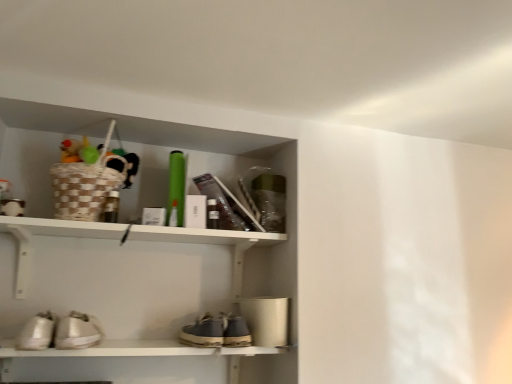
Question: From a real-world perspective, is leather suede shoe at center located higher than white leather sneakers at lower left, positioned as the 2th footwear in right-to-left order?

Choices:
 (A) no
 (B) yes

Answer: (B)

Question: Does leather suede shoe at center have a smaller size compared to white leather sneakers at lower left, arranged as the first footwear when viewed from the left?

Choices:
 (A) yes
 (B) no

Answer: (B)

Question: Is white leather sneakers at lower left, positioned as the 2th footwear in right-to-left order, at the back of leather suede shoe at center?

Choices:
 (A) yes
 (B) no

Answer: (B)

Question: Is leather suede shoe at center taller than white leather sneakers at lower left, arranged as the first footwear when viewed from the left?

Choices:
 (A) no
 (B) yes

Answer: (B)

Question: Would you say leather suede shoe at center is outside white leather sneakers at lower left, arranged as the first footwear when viewed from the left?

Choices:
 (A) yes
 (B) no

Answer: (A)

Question: Looking at the image, does leather suede shoe at center seem bigger or smaller compared to white leather sneakers at lower left, positioned as the 2th footwear in right-to-left order?

Choices:
 (A) small
 (B) big

Answer: (B)

Question: Considering the relative positions of leather suede shoe at center and white leather sneakers at lower left, arranged as the first footwear when viewed from the left, in the image provided, is leather suede shoe at center to the left or to the right of white leather sneakers at lower left, arranged as the first footwear when viewed from the left,?

Choices:
 (A) right
 (B) left

Answer: (A)

Question: From a real-world perspective, is leather suede shoe at center above or below white leather sneakers at lower left, arranged as the first footwear when viewed from the left?

Choices:
 (A) below
 (B) above

Answer: (B)

Question: Is leather suede shoe at center inside or outside of white leather sneakers at lower left, positioned as the 2th footwear in right-to-left order?

Choices:
 (A) outside
 (B) inside

Answer: (A)

Question: Considering the positions of point (217, 231) and point (231, 342), is point (217, 231) closer or farther from the camera than point (231, 342)?

Choices:
 (A) farther
 (B) closer

Answer: (A)

Question: From the image's perspective, is white matte shelf at upper center positioned above or below leather suede shoe at center?

Choices:
 (A) above
 (B) below

Answer: (A)

Question: Choose the correct answer: Is white matte shelf at upper center inside leather suede shoe at center or outside it?

Choices:
 (A) inside
 (B) outside

Answer: (B)

Question: Is white matte shelf at upper center in front of or behind leather suede shoe at center in the image?

Choices:
 (A) behind
 (B) front

Answer: (B)

Question: From the image's perspective, is shiny metallic sneakers at lower left, which is the 1th footwear from right to left, positioned above or below white leather sneakers at lower left, arranged as the first footwear when viewed from the left?

Choices:
 (A) below
 (B) above

Answer: (A)

Question: Is shiny metallic sneakers at lower left, which is the 1th footwear from right to left, spatially inside white leather sneakers at lower left, arranged as the first footwear when viewed from the left, or outside of it?

Choices:
 (A) inside
 (B) outside

Answer: (B)